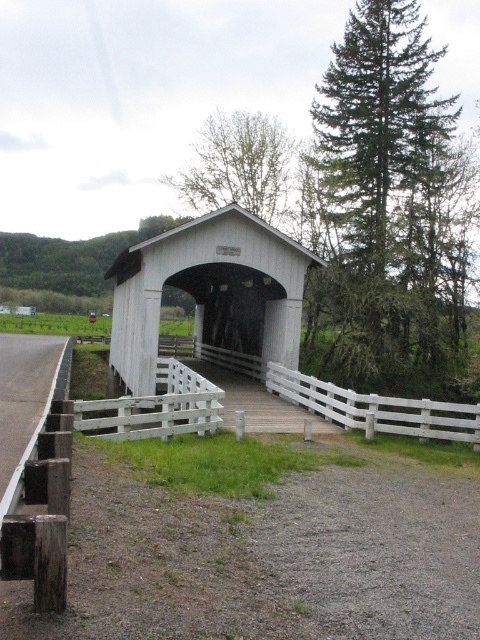
You are standing at the entrance of the covered bridge and want to take a photo that includes both point (175, 285) and point (60, 369). Since you want to ensure both points are in focus, which point should you focus on to maximize the depth of field?

You should focus on point (175, 285) because it is closer to the camera than point (60, 369). Focusing on the closer object will ensure both points are within the depth of field.

You are a cyclist approaching the scene and want to cross the white wooden bridge at center. There is a smooth asphalt road at lower left leading towards it. Based on the scene, which direction should you turn to reach the bridge?

The white wooden bridge at center is further to the viewer than the smooth asphalt road at lower left, so you should continue straight ahead along the smooth asphalt road at lower left to reach the bridge.